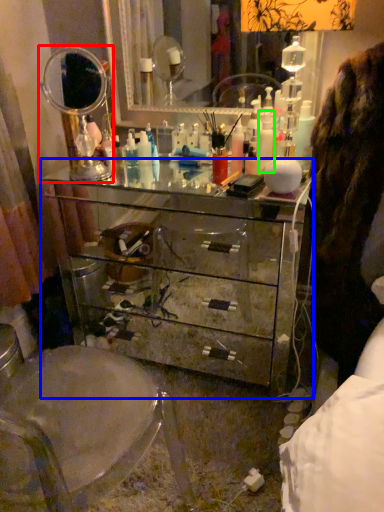
Question: Which object is the farthest from mirror (highlighted by a red box)? Choose among these: chest of drawers (highlighted by a blue box) or toiletry (highlighted by a green box).

Choices:
 (A) chest of drawers
 (B) toiletry

Answer: (B)